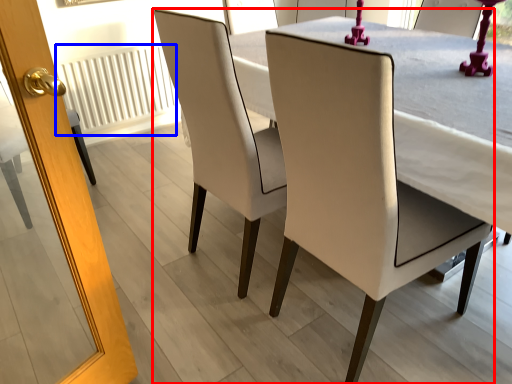
Question: Which point is closer to the camera, chair (highlighted by a red box) or radiator (highlighted by a blue box)?

Choices:
 (A) chair
 (B) radiator

Answer: (A)